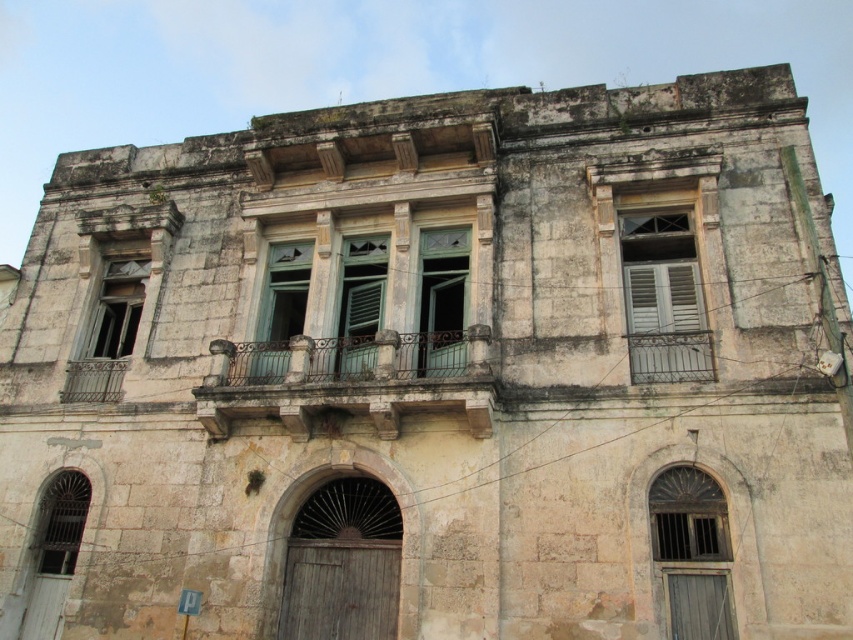
Question: Which point appears farthest from the camera in this image?

Choices:
 (A) (250, 374)
 (B) (688, 355)
 (C) (368, 340)

Answer: (A)

Question: Is white wooden window at upper right thinner than matte glass window at center left?

Choices:
 (A) yes
 (B) no

Answer: (B)

Question: Can you confirm if white wooden window at upper right is bigger than green matte window at center?

Choices:
 (A) no
 (B) yes

Answer: (B)

Question: Is rusty metal balcony at center positioned before matte glass window at lower left?

Choices:
 (A) no
 (B) yes

Answer: (B)

Question: Among these points, which one is nearest to the camera?

Choices:
 (A) (44, 552)
 (B) (289, 326)

Answer: (A)

Question: Which of the following is the farthest from the observer?

Choices:
 (A) green glass window at center
 (B) green matte window at center
 (C) matte glass window at center left
 (D) matte glass window at lower left

Answer: (C)